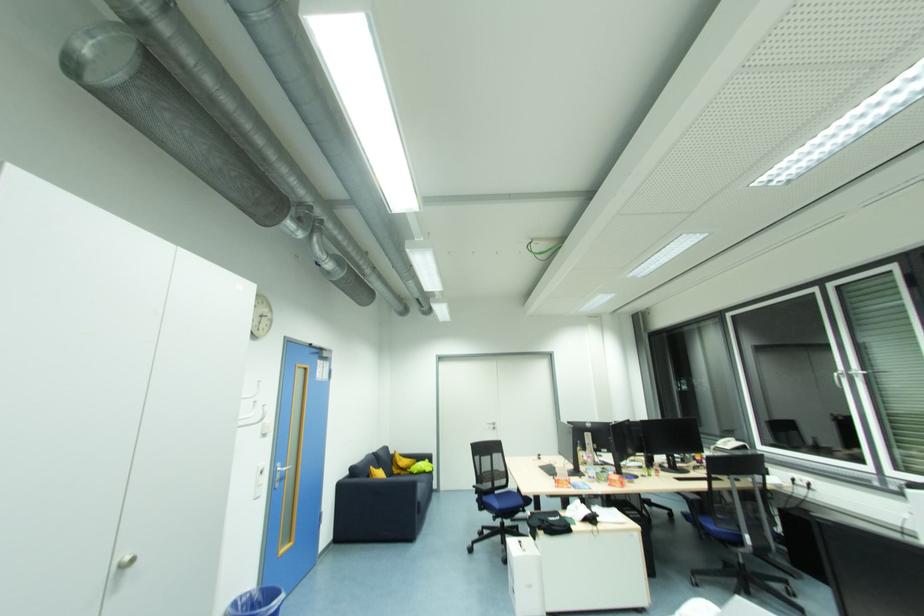
Describe the element at coordinates (377, 492) in the screenshot. I see `the blue sofa armrest` at that location.